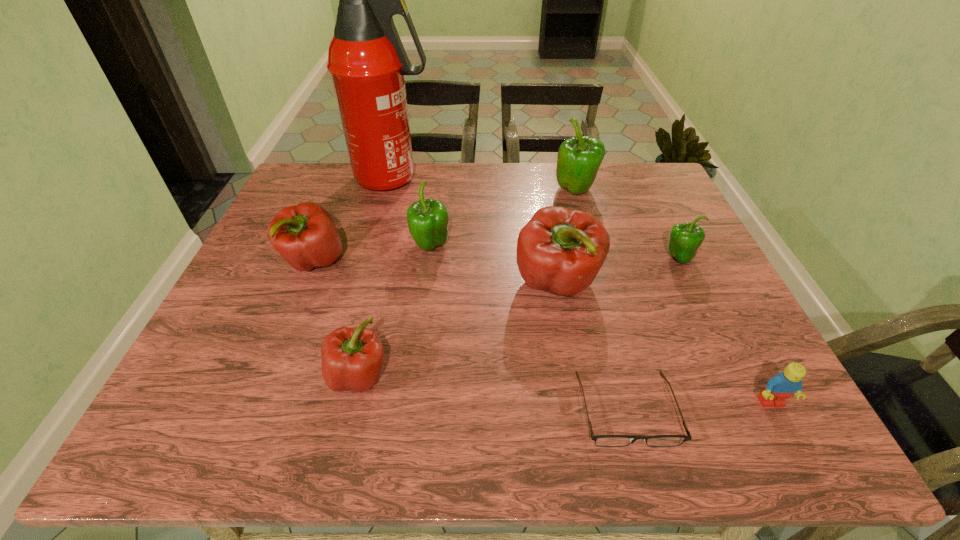
Image resolution: width=960 pixels, height=540 pixels. Identify the location of vacant space at the far edge. (504, 197).

Locate an element on the screen. Image resolution: width=960 pixels, height=540 pixels. free location at the near edge is located at coordinates point(621,447).

Locate an element on the screen. blank space at the left edge of the desktop is located at coordinates (294, 274).

Image resolution: width=960 pixels, height=540 pixels. I want to click on free space at the right edge, so click(x=707, y=302).

The height and width of the screenshot is (540, 960). What are the coordinates of `vacant area at the far left corner of the desktop` in the screenshot? It's located at (336, 201).

Where is `vacant region at the far right corner of the desktop`? vacant region at the far right corner of the desktop is located at coordinates (631, 165).

Locate an element on the screen. Image resolution: width=960 pixels, height=540 pixels. vacant space that is in between the shortest object and the rightmost pink bell pepper is located at coordinates (592, 346).

At what (x,y) coordinates should I click in order to perform the action: click on vacant space that is in between the rightmost pink bell pepper and the spectacles. Please return your answer as a coordinate pair (x, y). Image resolution: width=960 pixels, height=540 pixels. Looking at the image, I should click on (592, 346).

The width and height of the screenshot is (960, 540). I want to click on free point between the second pink bell pepper from left to right and the leftmost green bell pepper, so [395, 311].

Where is `free space between the fire extinguisher and the biggest green bell pepper`? The image size is (960, 540). free space between the fire extinguisher and the biggest green bell pepper is located at coordinates (485, 185).